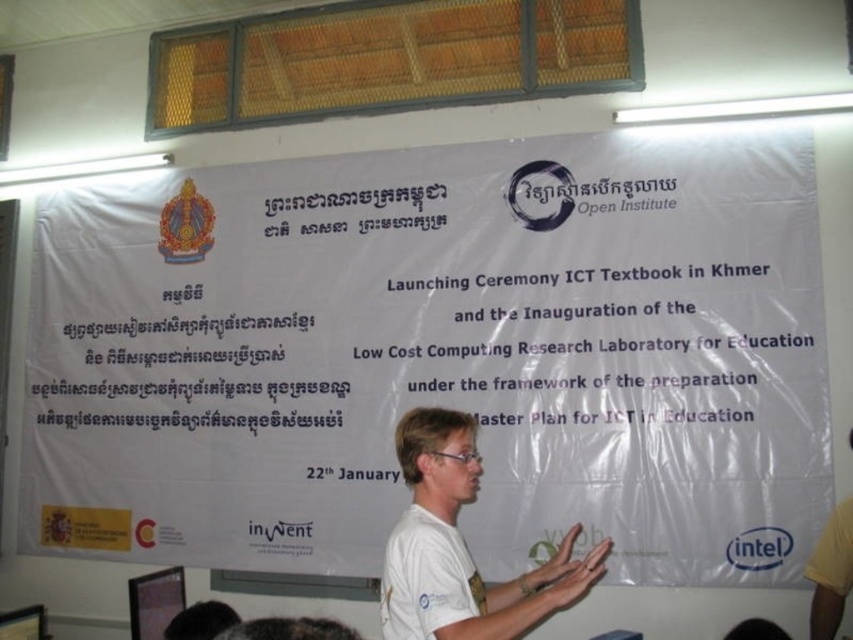
Between white paper at center and white matte hand at center, which one is positioned lower?

white matte hand at center is lower down.

Who is more distant from viewer, [776,134] or [584,588]?

The point [776,134] is behind.

Locate an element on the screen. The width and height of the screenshot is (853, 640). white paper at center is located at coordinates (438, 355).

Can you confirm if white matte shirt at center is positioned below white matte hand at center?

No.

Is white matte shirt at center positioned before white matte hand at center?

Yes, it is in front of white matte hand at center.

Does point (408, 483) lie behind point (589, 580)?

Yes, it is behind point (589, 580).

Locate an element on the screen. white matte shirt at center is located at coordinates (461, 547).

Is white paper at center behind white matte shirt at center?

Yes, white paper at center is behind white matte shirt at center.

Who is higher up, white paper at center or white matte shirt at center?

white paper at center is higher up.

Which is in front, point (445, 179) or point (508, 580)?

Point (508, 580) is more forward.

You are a GUI agent. You are given a task and a screenshot of the screen. Output one action in this format:
    pyautogui.click(x=<x>, y=<y>)
    Task: Click on the white paper at center
    The width and height of the screenshot is (853, 640).
    Given the screenshot: What is the action you would take?
    pyautogui.click(x=438, y=355)